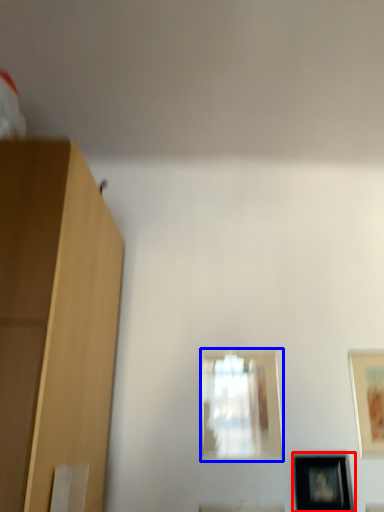
Question: Among these objects, which one is farthest to the camera, picture frame (highlighted by a red box) or picture frame (highlighted by a blue box)?

Choices:
 (A) picture frame
 (B) picture frame

Answer: (B)